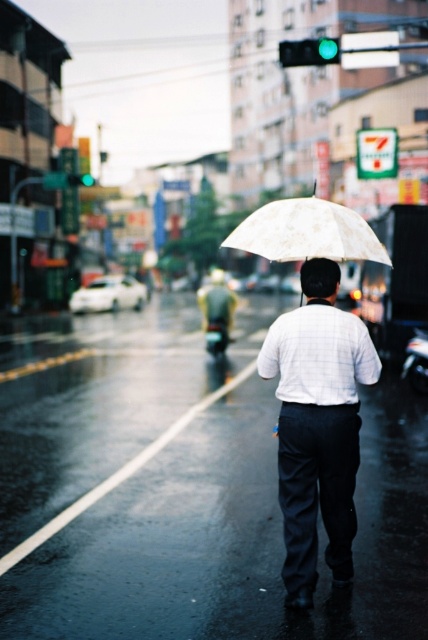
Is white checkered shirt at center shorter than white floral-patterned umbrella at center?

In fact, white checkered shirt at center may be taller than white floral-patterned umbrella at center.

Who is higher up, white checkered shirt at center or white floral-patterned umbrella at center?

white floral-patterned umbrella at center is higher up.

Is point (353, 392) farther from camera compared to point (273, 221)?

No, (353, 392) is closer to viewer.

The width and height of the screenshot is (428, 640). I want to click on white checkered shirt at center, so click(318, 426).